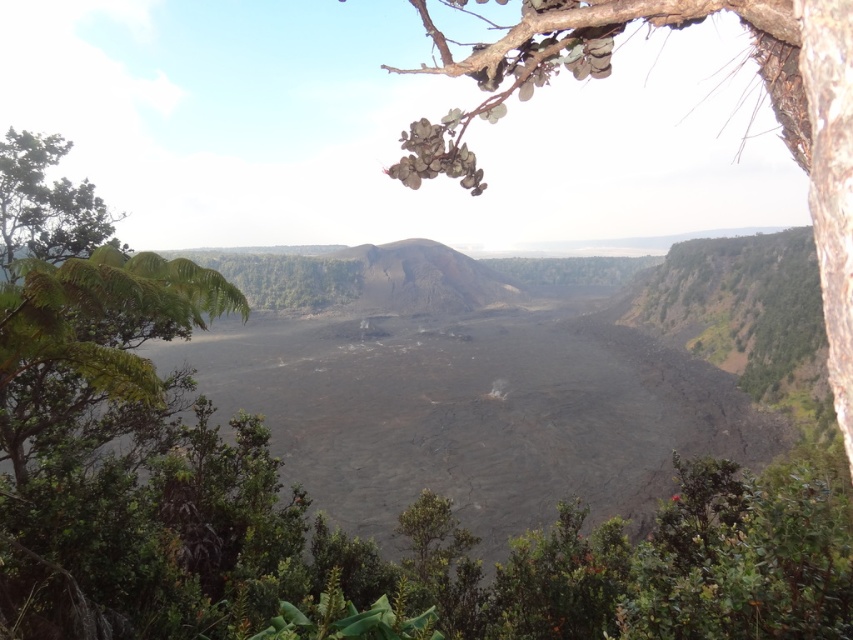
Can you confirm if green leafy branch at upper center is thinner than green leafy tree at upper left?

Correct, green leafy branch at upper center's width is less than green leafy tree at upper left's.

Is point (540, 20) positioned before point (27, 196)?

Yes, point (540, 20) is in front of point (27, 196).

The image size is (853, 640). In order to click on green leafy branch at upper center in this screenshot , I will do `click(758, 74)`.

The height and width of the screenshot is (640, 853). Identify the location of green leafy branch at upper center. (758, 74).